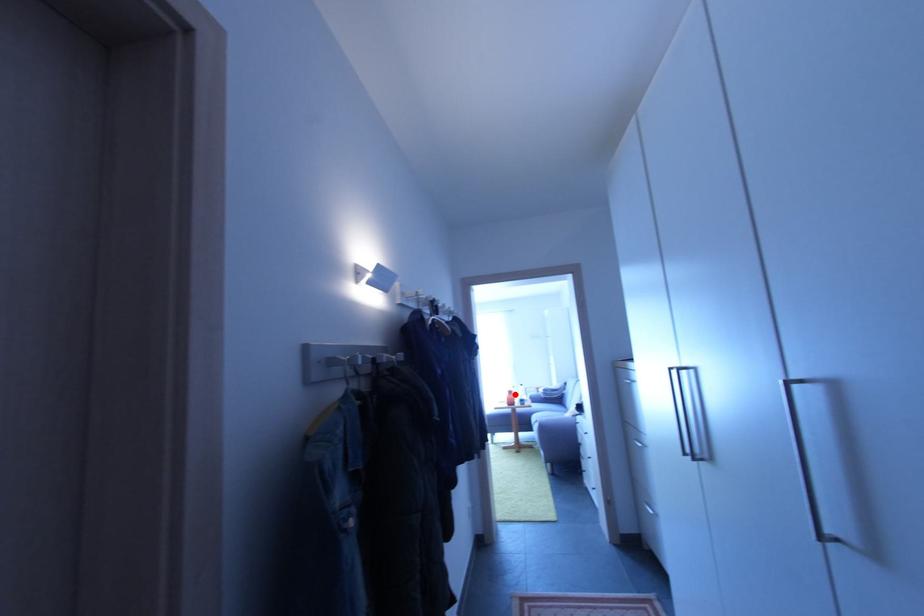
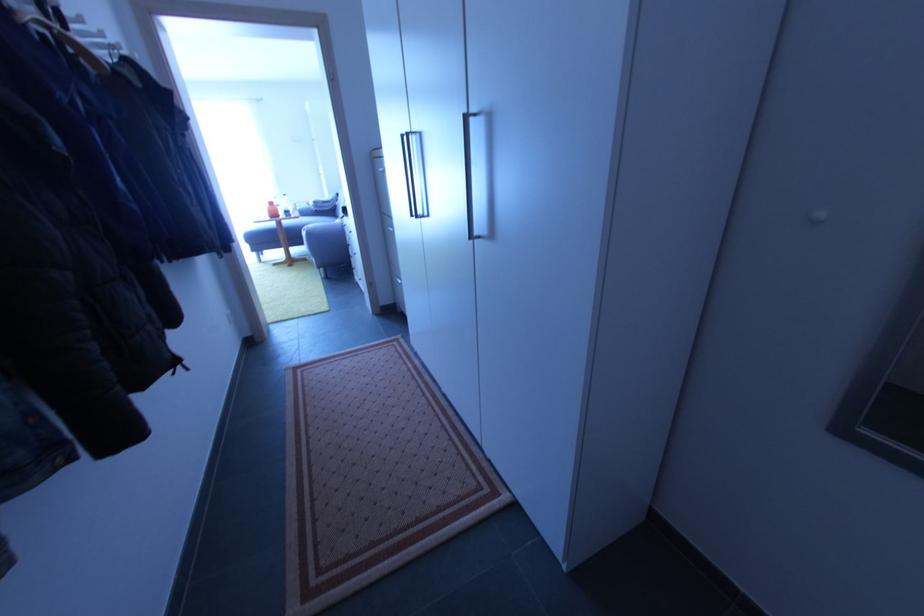
Question: I am providing you with two images of the same scene from different viewpoints. In image1, a red point is highlighted. Considering the same 3D point in image2, which of the following is correct?

Choices:
 (A) It is closer
 (B) It is farther

Answer: (A)